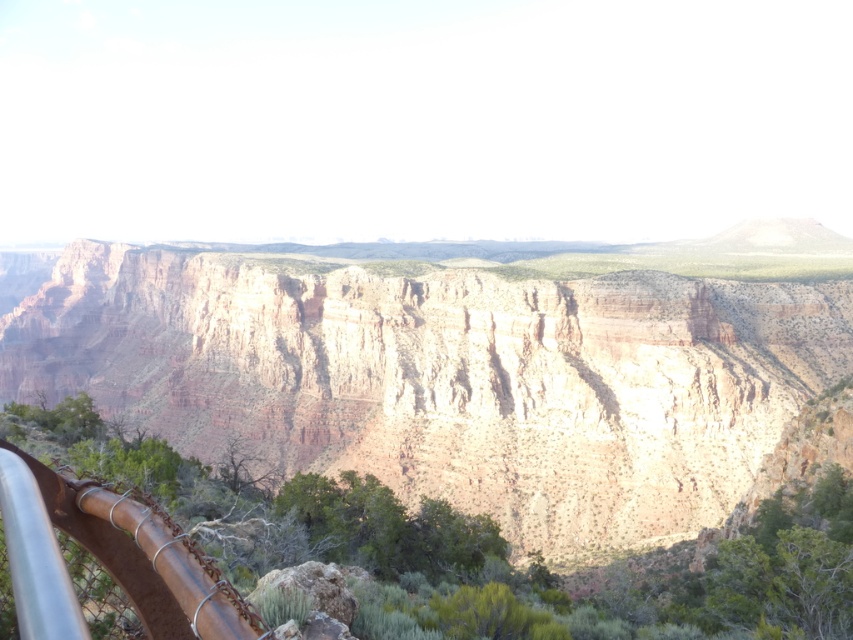
Question: Does rustic rock formation at center appear on the left side of rusty metal rail at lower left?

Choices:
 (A) yes
 (B) no

Answer: (B)

Question: Can you confirm if rustic rock formation at center is bigger than rusty metal rail at lower left?

Choices:
 (A) no
 (B) yes

Answer: (B)

Question: Is rustic rock formation at center bigger than rusty metal rail at lower left?

Choices:
 (A) no
 (B) yes

Answer: (B)